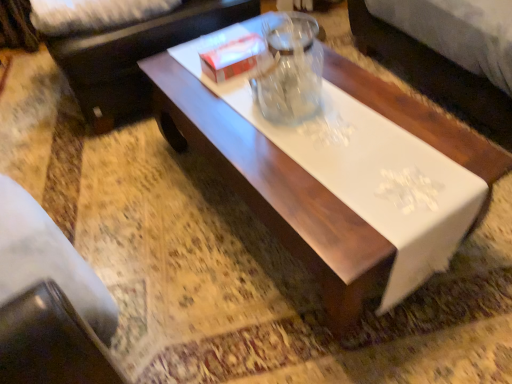
Describe the element at coordinates (274, 190) in the screenshot. The image size is (512, 384). I see `white glossy coffee table at center` at that location.

Describe the element at coordinates (134, 57) in the screenshot. The height and width of the screenshot is (384, 512). I see `dark brown leather couch at upper left` at that location.

You are a GUI agent. You are given a task and a screenshot of the screen. Output one action in this format:
    pyautogui.click(x=<x>, y=<y>)
    Task: Click on the white glossy coffee table at center
    
    Given the screenshot: What is the action you would take?
    pyautogui.click(x=274, y=190)

Does white cardboard box at center appear on the right side of white glossy coffee table at center?

No, white cardboard box at center is not to the right of white glossy coffee table at center.

Does white cardboard box at center have a greater width compared to white glossy coffee table at center?

Incorrect, the width of white cardboard box at center does not surpass that of white glossy coffee table at center.

From a real-world perspective, is white cardboard box at center physically located above or below white glossy coffee table at center?

From a real-world perspective, white cardboard box at center is physically above white glossy coffee table at center.

Considering the relative sizes of white glossy coffee table at center and white cardboard box at center in the image provided, is white glossy coffee table at center shorter than white cardboard box at center?

In fact, white glossy coffee table at center may be taller than white cardboard box at center.

From the image's perspective, is white glossy coffee table at center located beneath white cardboard box at center?

Yes, from the image's perspective, white glossy coffee table at center is below white cardboard box at center.

Are white glossy coffee table at center and white cardboard box at center beside each other?

No, white glossy coffee table at center is not making contact with white cardboard box at center.

From a real-world perspective, is white glossy coffee table at center beneath white cardboard box at center?

Yes, from a real-world perspective, white glossy coffee table at center is beneath white cardboard box at center.

Measure the distance between dark brown leather couch at upper left and white glossy coffee table at center.

dark brown leather couch at upper left is 19.41 inches from white glossy coffee table at center.

Is dark brown leather couch at upper left thinner than white glossy coffee table at center?

Indeed, dark brown leather couch at upper left has a lesser width compared to white glossy coffee table at center.

Is dark brown leather couch at upper left closer to the viewer compared to white glossy coffee table at center?

No, dark brown leather couch at upper left is further to the viewer.

Between dark brown leather couch at upper left and white glossy coffee table at center, which one has smaller size?

With smaller size is dark brown leather couch at upper left.

Can you confirm if white glossy coffee table at center is shorter than dark brown leather couch at upper left?

Incorrect, the height of white glossy coffee table at center does not fall short of that of dark brown leather couch at upper left.

Considering the sizes of objects white glossy coffee table at center and dark brown leather couch at upper left in the image provided, who is thinner, white glossy coffee table at center or dark brown leather couch at upper left?

dark brown leather couch at upper left is thinner.

From the picture: Are white glossy coffee table at center and dark brown leather couch at upper left making contact?

white glossy coffee table at center and dark brown leather couch at upper left are clearly separated.

From a real-world perspective, is white cardboard box at center above or below dark brown leather couch at upper left?

In terms of real-world spatial position, white cardboard box at center is above dark brown leather couch at upper left.

Is the depth of white cardboard box at center greater than that of dark brown leather couch at upper left?

No, white cardboard box at center is in front of dark brown leather couch at upper left.

Measure the distance from white cardboard box at center to dark brown leather couch at upper left.

white cardboard box at center is 18.22 inches from dark brown leather couch at upper left.

Locate an element on the screen. This screenshot has height=384, width=512. box lying below the dark brown leather couch at upper left (from the image's perspective) is located at coordinates (237, 59).

From the image's perspective, which one is positioned higher, dark brown leather couch at upper left or white cardboard box at center?

dark brown leather couch at upper left appears higher in the image.

Is dark brown leather couch at upper left facing away from white cardboard box at center?

No, dark brown leather couch at upper left is not facing away from white cardboard box at center.

The height and width of the screenshot is (384, 512). In the image, there is a white cardboard box at center. In order to click on couch above it (from the image's perspective) in this screenshot , I will do `click(134, 57)`.

Where is `box on the left of white glossy coffee table at center`? This screenshot has height=384, width=512. box on the left of white glossy coffee table at center is located at coordinates (237, 59).

At what (x,y) coordinates should I click in order to perform the action: click on coffee table that is under the white cardboard box at center (from a real-world perspective). Please return your answer as a coordinate pair (x, y). The width and height of the screenshot is (512, 384). Looking at the image, I should click on (274, 190).

Estimate the real-world distances between objects in this image. Which object is further from white glossy coffee table at center, dark brown leather couch at upper left or white cardboard box at center?

dark brown leather couch at upper left.

Looking at the image, which one is located further to white cardboard box at center, dark brown leather couch at upper left or white glossy coffee table at center?

The object further to white cardboard box at center is dark brown leather couch at upper left.

Estimate the real-world distances between objects in this image. Which object is further from white glossy coffee table at center, white cardboard box at center or dark brown leather couch at upper left?

Based on the image, dark brown leather couch at upper left appears to be further to white glossy coffee table at center.

Looking at the image, which one is located closer to dark brown leather couch at upper left, white cardboard box at center or white glossy coffee table at center?

Among the two, white cardboard box at center is located nearer to dark brown leather couch at upper left.

Estimate the real-world distances between objects in this image. Which object is further from white cardboard box at center, white glossy coffee table at center or dark brown leather couch at upper left?

dark brown leather couch at upper left is further to white cardboard box at center.

Which object lies nearer to the anchor point dark brown leather couch at upper left, white glossy coffee table at center or white cardboard box at center?

white cardboard box at center is closer to dark brown leather couch at upper left.

The width and height of the screenshot is (512, 384). Identify the location of box between white glossy coffee table at center and dark brown leather couch at upper left along the z-axis. (237, 59).